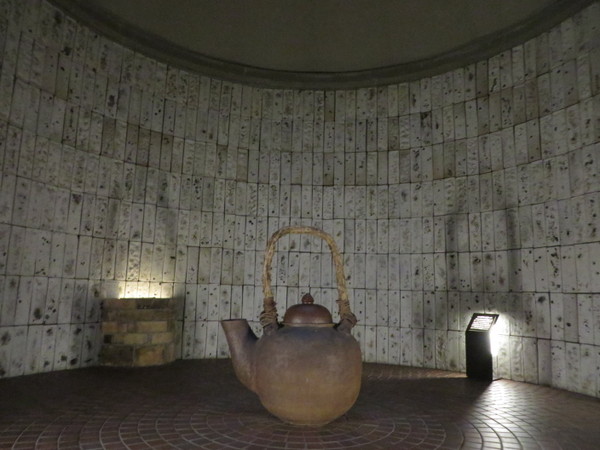
The image size is (600, 450). I want to click on kettle tea on lid, so click(322, 306).